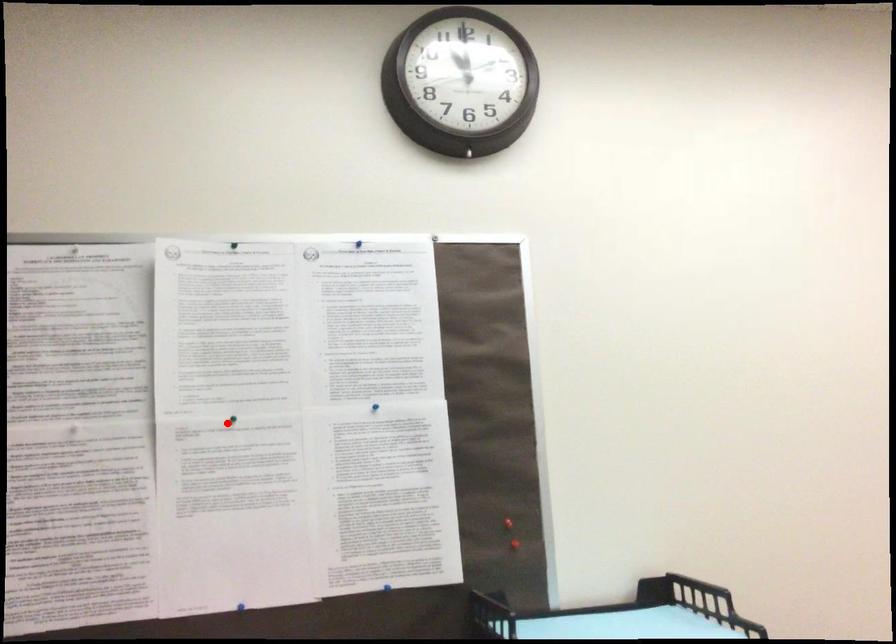
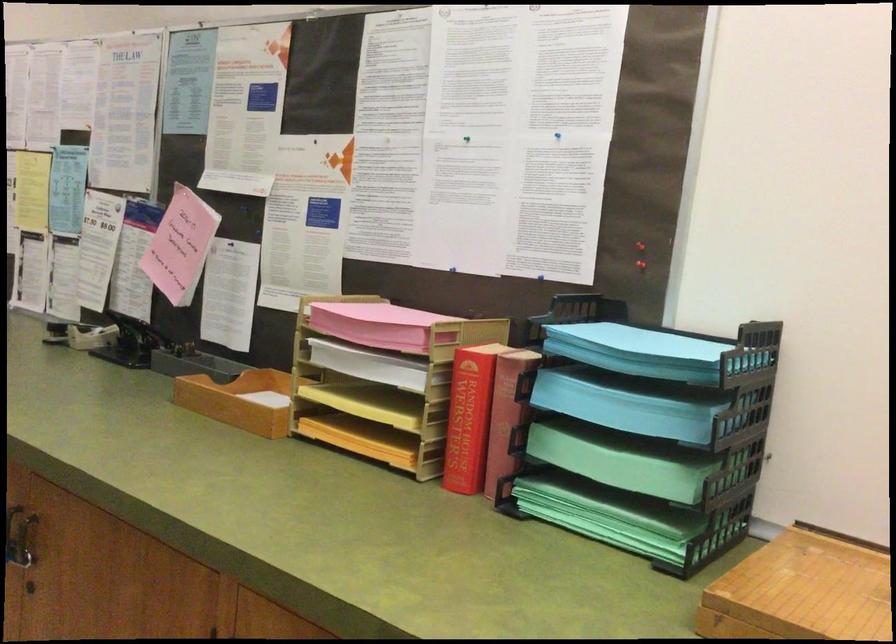
Question: I am providing you with two images of the same scene from different viewpoints. Given a red point in image1, look at the same physical point in image2. Is it:

Choices:
 (A) Closer to the viewpoint
 (B) Farther from the viewpoint

Answer: (B)